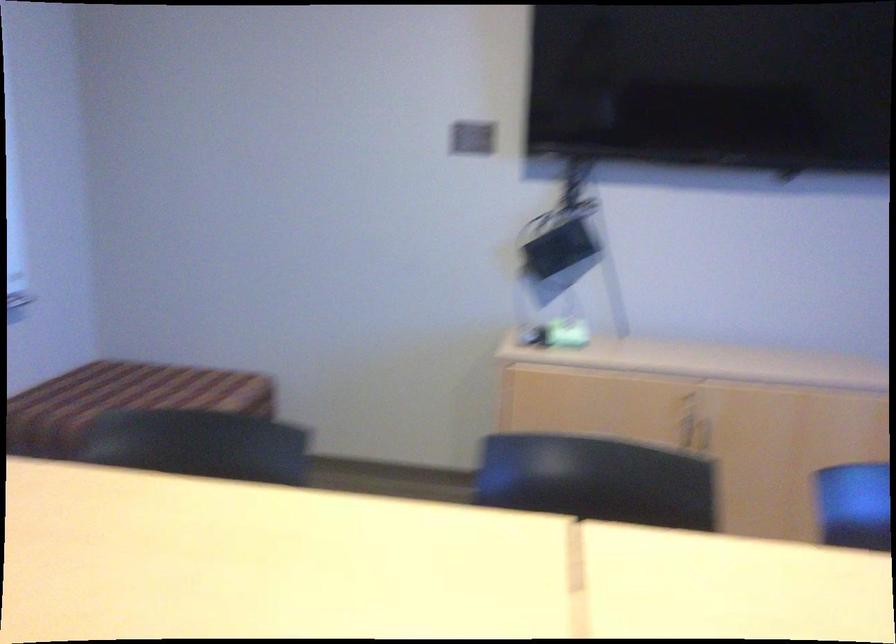
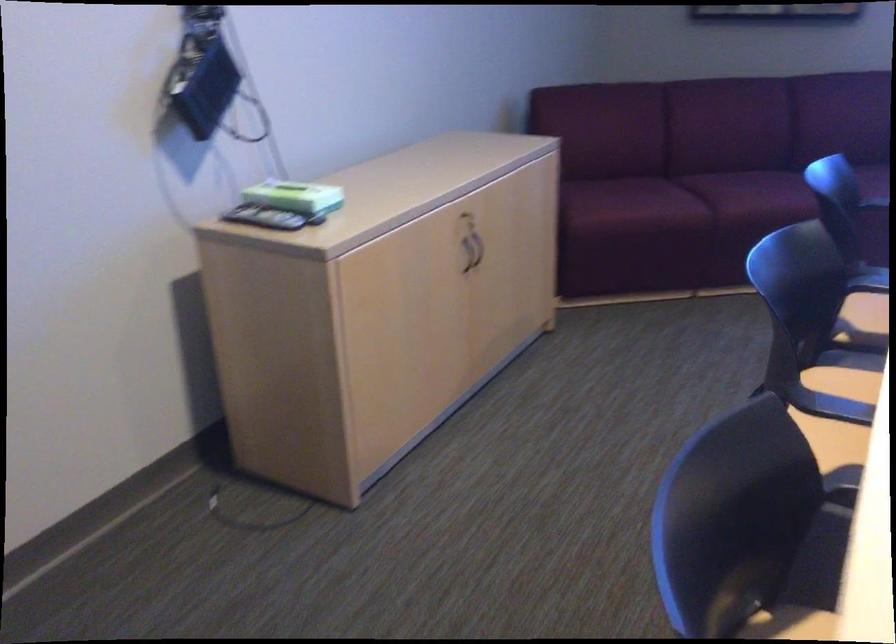
In the second image, find the point that corresponds to [517,328] in the first image.

(263, 218)